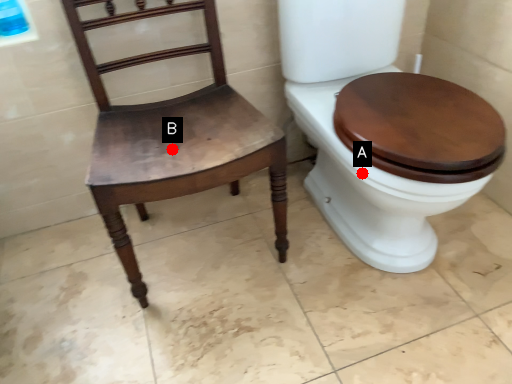
Question: Two points are circled on the image, labeled by A and B beside each circle. Which point appears farthest from the camera in this image?

Choices:
 (A) A is further
 (B) B is further

Answer: (B)